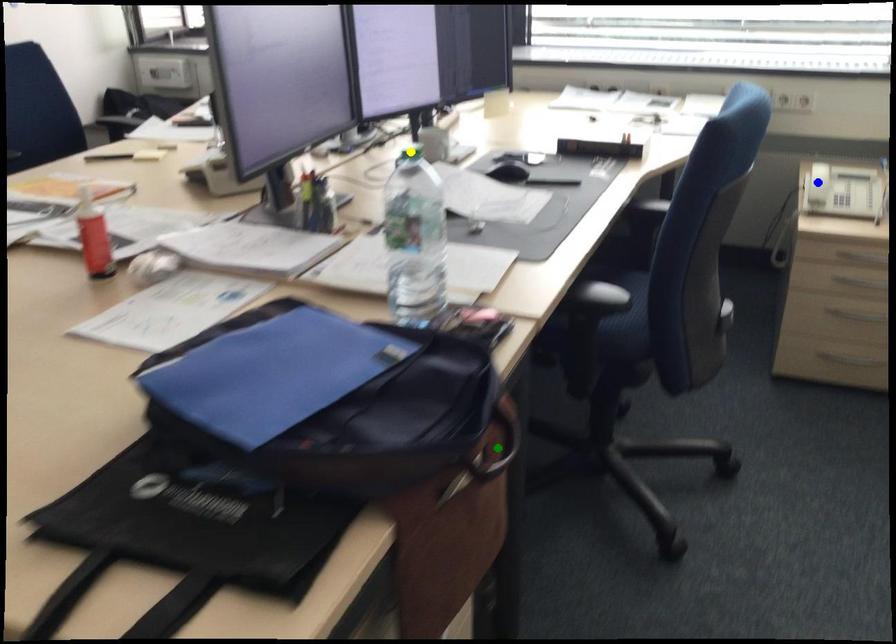
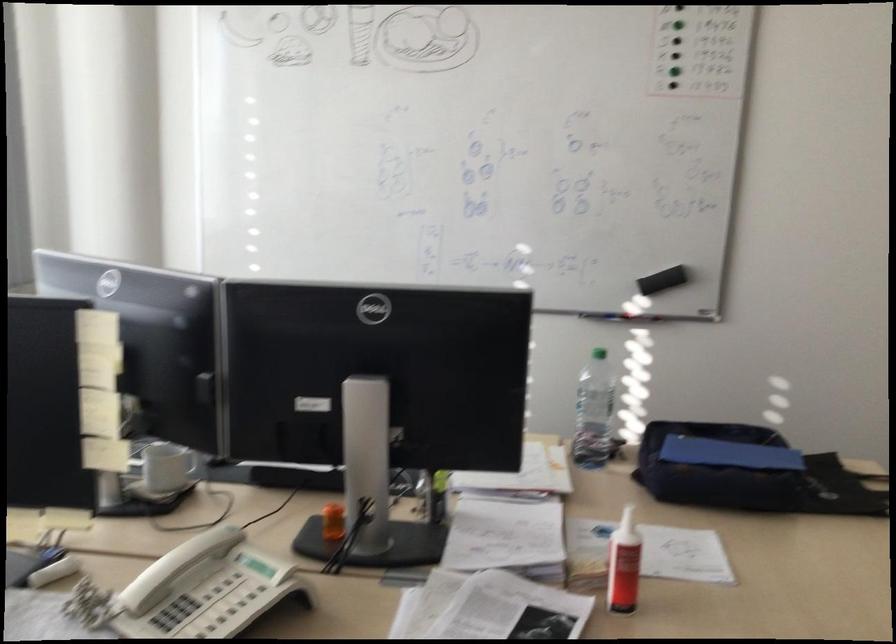
I am providing you with two images of the same scene from different viewpoints. Three points are marked in image1. Which point corresponds to a part or object that is occluded in image2?In image1, three points are marked. Which of them correspond to a part or object that is occluded in image2?Among the three points shown in image1, which one corresponds to a part or object that is no longer visible due to occlusion in image2?

yellow point, blue point, green point